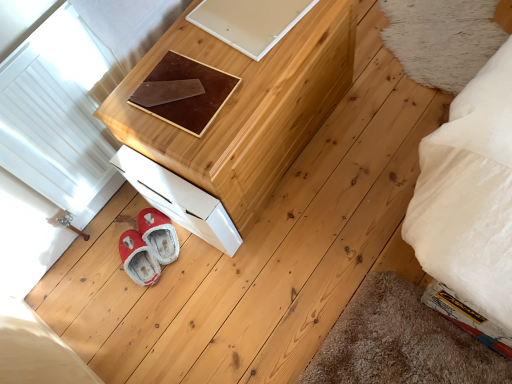
Question: Is brown leather pad at center wider than white glossy drawer at lower left?

Choices:
 (A) no
 (B) yes

Answer: (A)

Question: Is brown leather pad at center thinner than white glossy drawer at lower left?

Choices:
 (A) no
 (B) yes

Answer: (B)

Question: Would you say brown leather pad at center is a long distance from white glossy drawer at lower left?

Choices:
 (A) yes
 (B) no

Answer: (B)

Question: From the image's perspective, is brown leather pad at center on white glossy drawer at lower left?

Choices:
 (A) no
 (B) yes

Answer: (B)

Question: Is the depth of brown leather pad at center less than that of white glossy drawer at lower left?

Choices:
 (A) yes
 (B) no

Answer: (A)

Question: Does brown leather pad at center turn towards white glossy drawer at lower left?

Choices:
 (A) yes
 (B) no

Answer: (B)

Question: From the image's perspective, is natural wood chest of drawers at upper center under white glossy drawer at lower left?

Choices:
 (A) no
 (B) yes

Answer: (A)

Question: Can you see natural wood chest of drawers at upper center touching white glossy drawer at lower left?

Choices:
 (A) no
 (B) yes

Answer: (A)

Question: Is natural wood chest of drawers at upper center far from white glossy drawer at lower left?

Choices:
 (A) yes
 (B) no

Answer: (B)

Question: Does natural wood chest of drawers at upper center have a greater width compared to white glossy drawer at lower left?

Choices:
 (A) no
 (B) yes

Answer: (B)

Question: From a real-world perspective, is natural wood chest of drawers at upper center on top of white glossy drawer at lower left?

Choices:
 (A) yes
 (B) no

Answer: (A)

Question: Considering the relative sizes of natural wood chest of drawers at upper center and white glossy drawer at lower left in the image provided, is natural wood chest of drawers at upper center smaller than white glossy drawer at lower left?

Choices:
 (A) no
 (B) yes

Answer: (A)

Question: Considering the relative sizes of white glossy drawer at lower left and brown leather pad at center in the image provided, is white glossy drawer at lower left wider than brown leather pad at center?

Choices:
 (A) yes
 (B) no

Answer: (A)